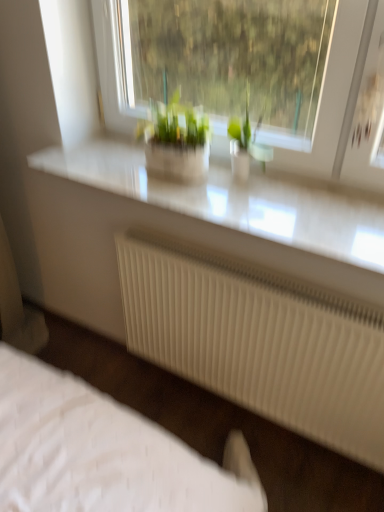
Question: From a real-world perspective, relative to green glass vase at center, the 2th houseplant positioned from the left, is green matte plant at center, the 2th houseplant from the right, vertically above or below?

Choices:
 (A) above
 (B) below

Answer: (B)

Question: From the image's perspective, is green matte plant at center, which is counted as the first houseplant, starting from the left, located above or below green glass vase at center, the 2th houseplant positioned from the left?

Choices:
 (A) above
 (B) below

Answer: (A)

Question: Which object is the farthest from the white ribbed radiator at lower center?

Choices:
 (A) green glass vase at center, the 2th houseplant positioned from the left
 (B) white quilted bed at lower left
 (C) white glossy counter top at upper center
 (D) green matte plant at center, which is counted as the first houseplant, starting from the left

Answer: (A)

Question: Considering the real-world distances, which object is farthest from the white ribbed radiator at lower center?

Choices:
 (A) green glass vase at center, which is the first houseplant in right-to-left order
 (B) white glossy counter top at upper center
 (C) white quilted bed at lower left
 (D) green matte plant at center, which is counted as the first houseplant, starting from the left

Answer: (A)